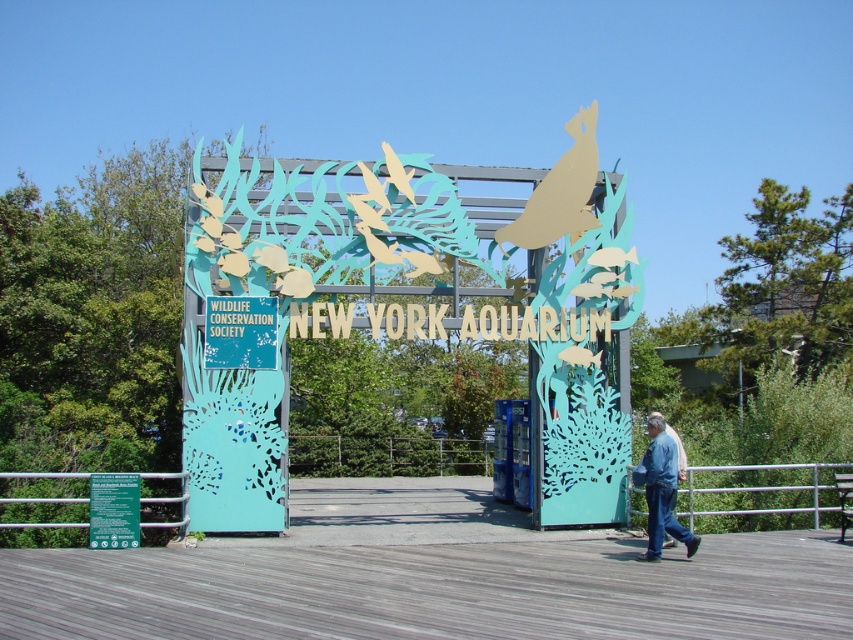
Describe the element at coordinates (408, 314) in the screenshot. The height and width of the screenshot is (640, 853). I see `metallic blue sign at center` at that location.

Does metallic blue sign at center have a greater height compared to blue paper sign at center?

No, metallic blue sign at center is not taller than blue paper sign at center.

Between point (233, 280) and point (223, 298), which one is positioned in front?

Positioned in front is point (223, 298).

At what (x,y) coordinates should I click in order to perform the action: click on metallic blue sign at center. Please return your answer as a coordinate pair (x, y). The height and width of the screenshot is (640, 853). Looking at the image, I should click on click(x=408, y=314).

Between metallic blue sign at center and blue jeans at lower right, which one appears on the right side from the viewer's perspective?

Positioned to the right is metallic blue sign at center.

In the scene shown: Can you confirm if metallic blue sign at center is bigger than blue jeans at lower right?

Actually, metallic blue sign at center might be smaller than blue jeans at lower right.

The height and width of the screenshot is (640, 853). Identify the location of metallic blue sign at center. (x=408, y=314).

How much distance is there between blue paper sign at center and blue jeans at lower right?

A distance of 4.91 meters exists between blue paper sign at center and blue jeans at lower right.

Which is above, blue paper sign at center or blue jeans at lower right?

Positioned higher is blue paper sign at center.

Where is `blue paper sign at center`? blue paper sign at center is located at coordinates (241, 332).